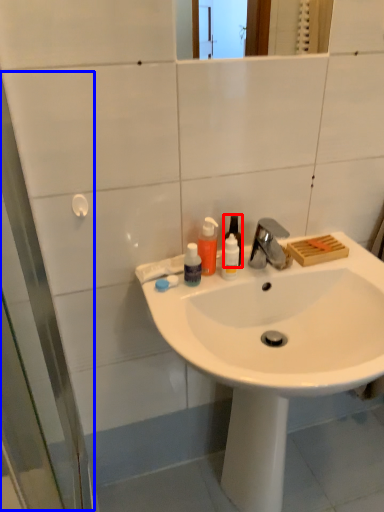
Question: Which object appears farthest to the camera in this image, bottle (highlighted by a red box) or screen door (highlighted by a blue box)?

Choices:
 (A) bottle
 (B) screen door

Answer: (A)